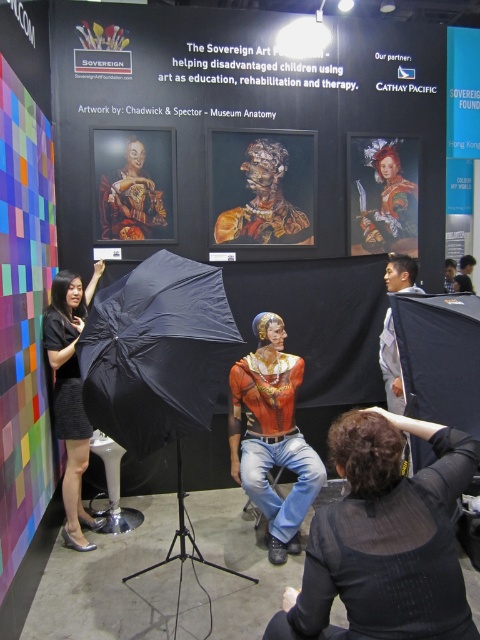
Based on the coordinates provided, where exactly is the matte red shirt at center located in the image?

The matte red shirt at center is located at the coordinates point [272,435].

You are a photographer at the exhibition and need to adjust the lighting. You see the black fabric umbrella at lower center and the black fabric umbrella at left. Which umbrella is positioned lower in the scene?

The black fabric umbrella at lower center is positioned lower than the black fabric umbrella at left.

You are a photographer standing in front of the matte red shirt at center. You need to take a closeup shot of the shirt. If your camera can focus on objects within 2 meters, will you be able to take the closeup without moving closer?

The matte red shirt at center is 3.04 meters from the viewer. Since the camera can only focus on objects within 2 meters, you will need to move closer to take the closeup shot.